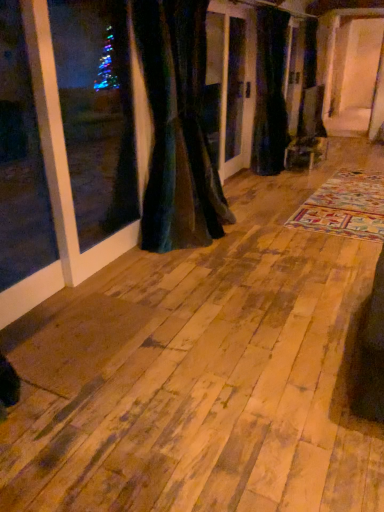
At what (x,y) coordinates should I click in order to perform the action: click on free spot to the right of velvet dark green curtain at center, arranged as the 2th curtain when viewed from the back. Please return your answer as a coordinate pair (x, y). The image size is (384, 512). Looking at the image, I should click on (253, 252).